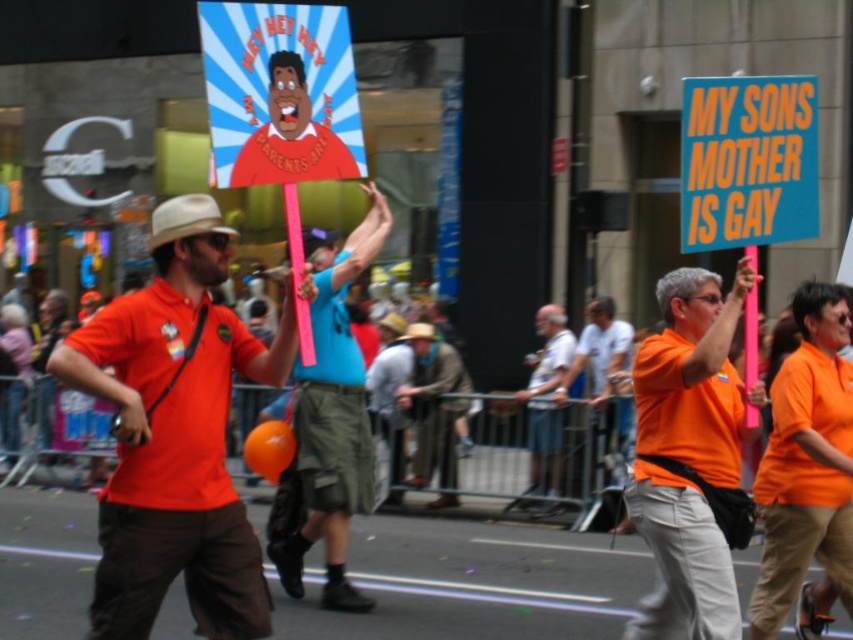
Question: Is matte orange shirt at center positioned in front of orange matte shirt at center?

Choices:
 (A) no
 (B) yes

Answer: (B)

Question: Estimate the real-world distances between objects in this image. Which object is closer to the orange matte shirt at center?

Choices:
 (A) orange cotton shirt at center
 (B) orange shirt at center

Answer: (A)

Question: In this image, where is orange matte shirt at center located relative to orange shirt at center?

Choices:
 (A) left
 (B) right

Answer: (B)

Question: Which point is farther from the camera taking this photo?

Choices:
 (A) (688, 492)
 (B) (355, 416)

Answer: (B)

Question: Can you confirm if orange matte shirt at center is thinner than blue cotton shirt at center?

Choices:
 (A) no
 (B) yes

Answer: (B)

Question: Estimate the real-world distances between objects in this image. Which object is farther from the blue cotton shirt at center?

Choices:
 (A) brown leather jacket at center
 (B) orange shirt at center
 (C) orange cotton shirt at center

Answer: (B)